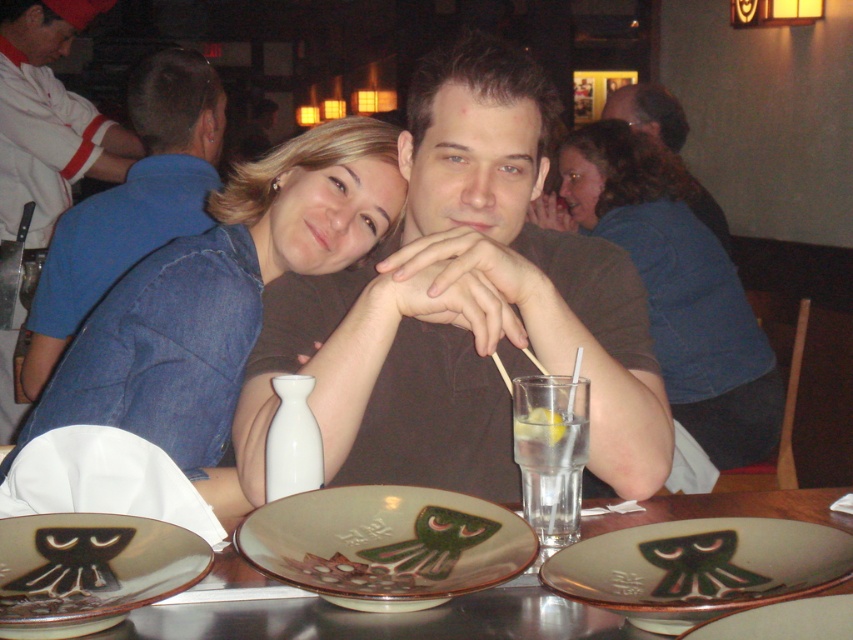
You are a server at the restaurant and need to place a new dish on the table. The dish is wider than the brown ceramic plate at center but narrower than the matte brown shirt at upper center. Is there enough space on the table to place the dish without overlapping any existing items?

The brown ceramic plate at center has a lesser width compared to matte brown shirt at upper center. Since the new dish is wider than the plate but narrower than the shirt, it may fit if there is space between them. However, the exact placement depends on the arrangement of items on the table, which isn

What object is located at the coordinate point (48,116) in the image?

The white matte chef hat at upper left is located at the coordinate point (48,116).